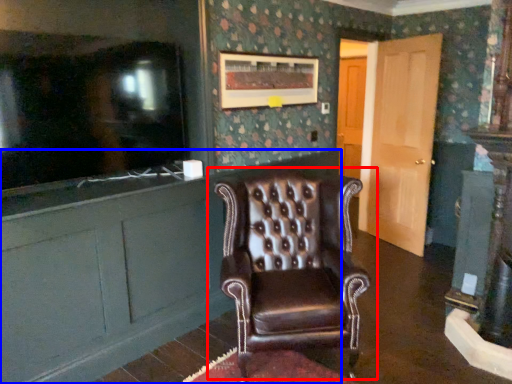
Question: Which object is closer to the camera taking this photo, chair (highlighted by a red box) or cabinetry (highlighted by a blue box)?

Choices:
 (A) chair
 (B) cabinetry

Answer: (B)